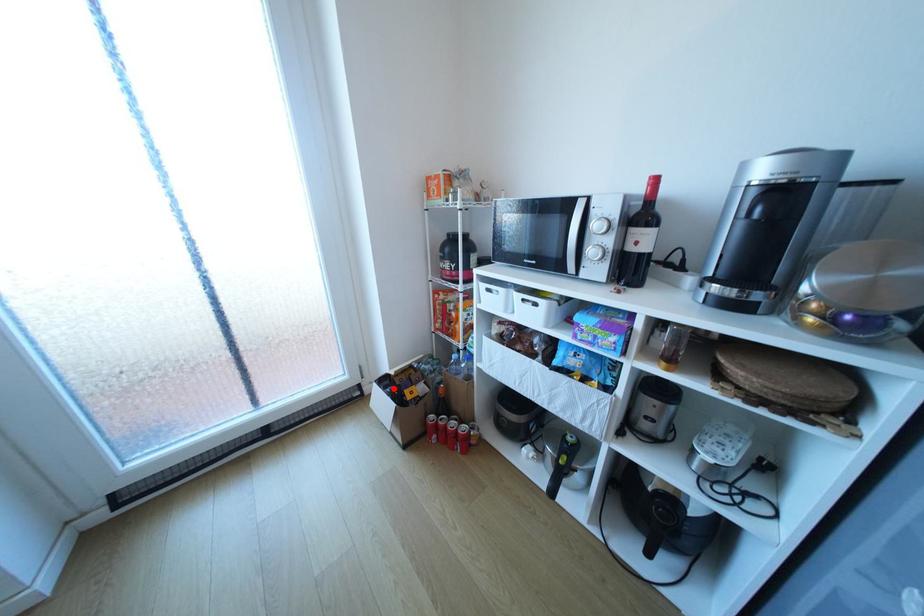
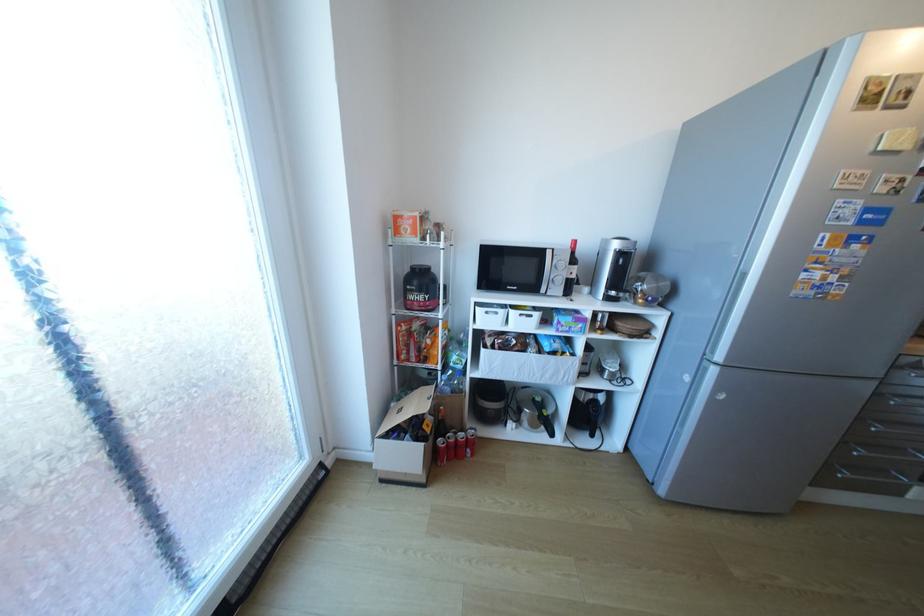
Question: A red point is marked in image1. In image2, is the corresponding 3D point closer to the camera or farther? Reply with the corresponding letter.

Choices:
 (A) The corresponding 3D point is closer.
 (B) The corresponding 3D point is farther.

Answer: (B)